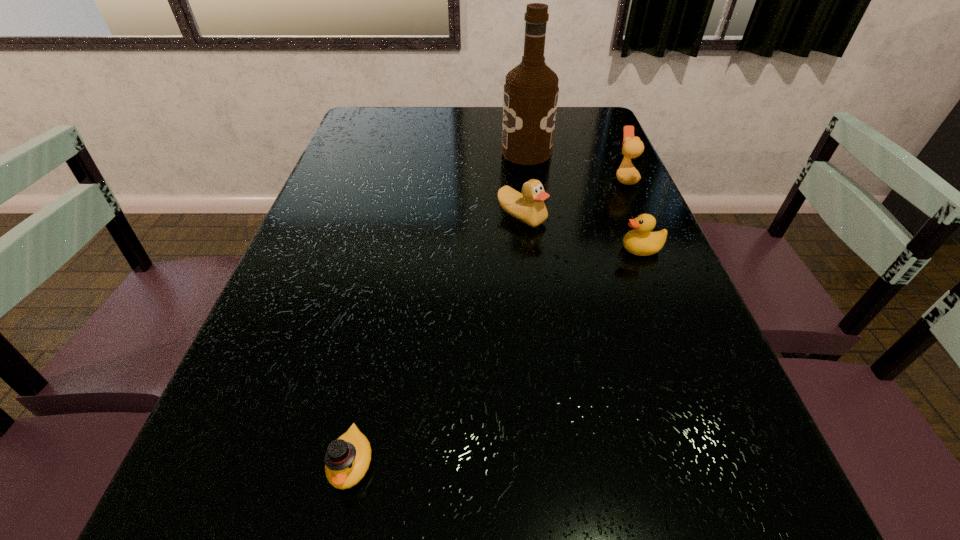
The image size is (960, 540). I want to click on the farthest object, so click(531, 90).

Where is `the tallest object`? the tallest object is located at coordinates (531, 90).

Locate an element on the screen. Image resolution: width=960 pixels, height=540 pixels. the fourth nearest object is located at coordinates (627, 174).

Image resolution: width=960 pixels, height=540 pixels. Identify the location of the third nearest duck. [x=529, y=207].

This screenshot has height=540, width=960. In order to click on the third duck from right to left in this screenshot , I will do `click(529, 207)`.

You are a GUI agent. You are given a task and a screenshot of the screen. Output one action in this format:
    pyautogui.click(x=<x>, y=<y>)
    Task: Click on the fourth farthest object
    
    Given the screenshot: What is the action you would take?
    pyautogui.click(x=640, y=241)

Locate an element on the screen. the third tallest duck is located at coordinates (640, 241).

Find the location of a particular element. the nearest duck is located at coordinates (347, 459).

Identify the location of the shortest duck. (347, 459).

Locate an element on the screen. vacant space located 0.300m on the label of the alcohol is located at coordinates (403, 152).